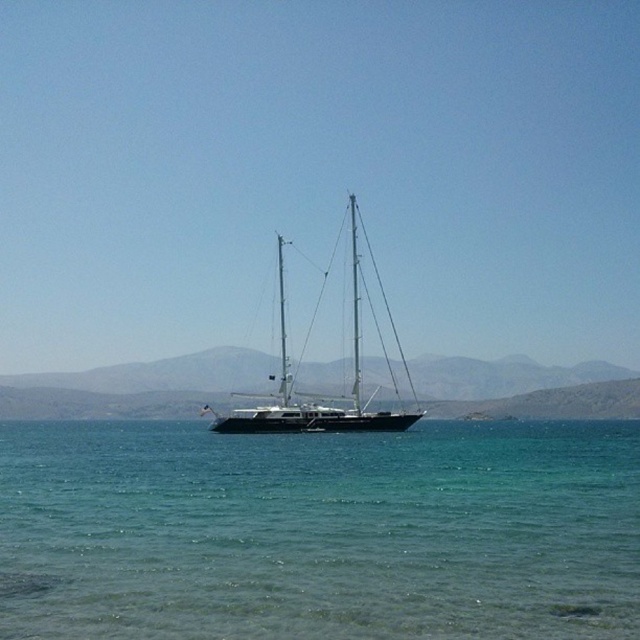
You are a photographer planning to capture the entire scene of the clear water at center and the shiny black sailboat at center in one shot. Given that your camera can only focus on objects within a 10m width, will both objects fit within the frame?

The clear water at center has a larger width than the shiny black sailboat at center. However, since the camera can focus on objects within a 10m width, it depends on the actual width of the clear water. If the clear water at center is wider than 10 meters, then it won

You are a photographer planning to capture the clear water at center and the shiny black sailboat at center in a single shot. Given that the camera you have can only focus on one object at a time, which object should you prioritize focusing on to ensure it appears sharp in the photo?

The shiny black sailboat at center should be prioritized for focus since it is larger than the clear water at center, making it more prominent in the composition.